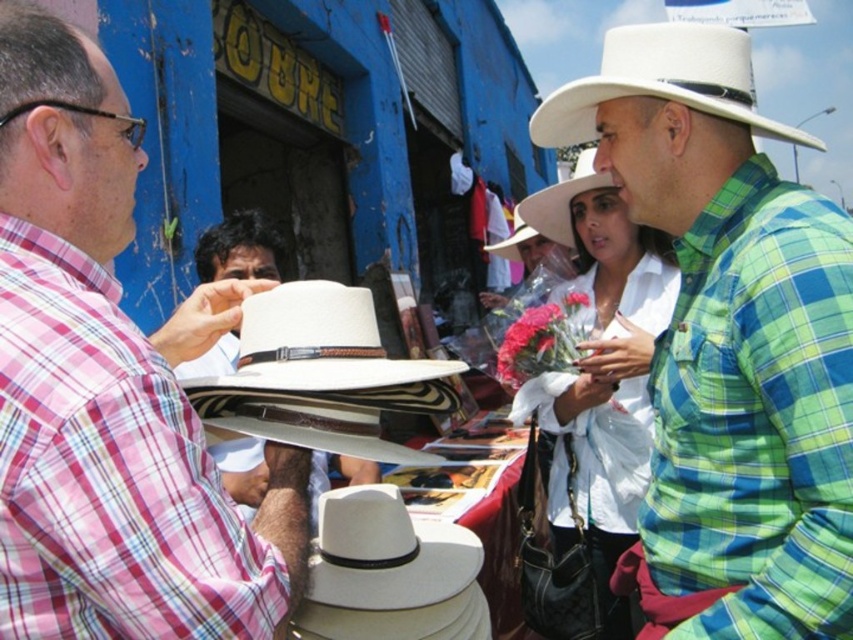
You are a customer at a market and see two hats for sale. The first is the matte white hat at left, and the second is the white matte cowboy hat at upper center. Which hat is larger?

The white matte cowboy hat at upper center is larger than the matte white hat at left.

You are a vendor at the market and want to display two hats to customers. You have a matte white hat at left and a white matte hat at center. Which hat should you recommend to a customer who prefers a larger size?

The white matte hat at center has a larger size than the matte white hat at left, so you should recommend the white matte hat at center to the customer who prefers a larger size.